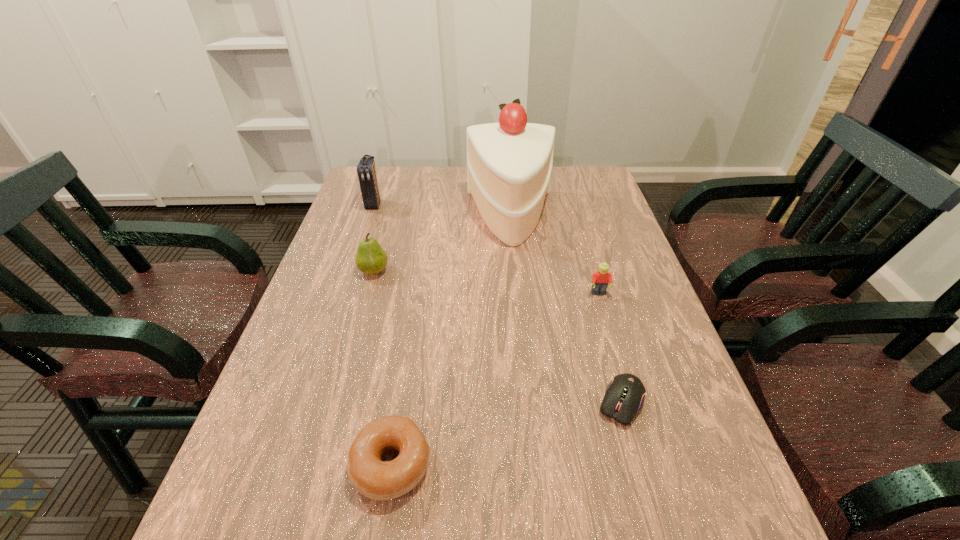
Find the location of a particular element. free space between the cake and the fifth shortest object is located at coordinates (443, 211).

Identify the location of vacant area between the bagel and the fifth shortest object. (383, 334).

The image size is (960, 540). I want to click on free point between the fifth farthest object and the fourth nearest object, so click(497, 337).

You are a GUI agent. You are given a task and a screenshot of the screen. Output one action in this format:
    pyautogui.click(x=<x>, y=<y>)
    Task: Click on the free space between the clutch bag and the third farthest object
    This screenshot has height=540, width=960.
    Given the screenshot: What is the action you would take?
    pyautogui.click(x=373, y=238)

The height and width of the screenshot is (540, 960). I want to click on vacant area that lies between the clutch bag and the fourth nearest object, so click(x=373, y=238).

You are a GUI agent. You are given a task and a screenshot of the screen. Output one action in this format:
    pyautogui.click(x=<x>, y=<y>)
    Task: Click on the free space that is in between the fourth nearest object and the fourth object from right to left
    
    Given the screenshot: What is the action you would take?
    pyautogui.click(x=382, y=368)

You are a GUI agent. You are given a task and a screenshot of the screen. Output one action in this format:
    pyautogui.click(x=<x>, y=<y>)
    Task: Click on the vacant space that is in between the clutch bag and the fourth tallest object
    The image size is (960, 540).
    Given the screenshot: What is the action you would take?
    pyautogui.click(x=487, y=249)

Identify which object is the third nearest to the fourth shortest object. Please provide its 2D coordinates. Your answer should be formatted as a tuple, i.e. [(x, y)], where the tuple contains the x and y coordinates of a point satisfying the conditions above.

[(373, 478)]

Find the location of a particular element. The height and width of the screenshot is (540, 960). object that ranks as the second closest to the shortest object is located at coordinates (373, 478).

The image size is (960, 540). Identify the location of vacant point that satisfies the following two spatial constraints: 1. on the front side of the fourth shortest object; 2. on the right side of the fifth farthest object. (337, 403).